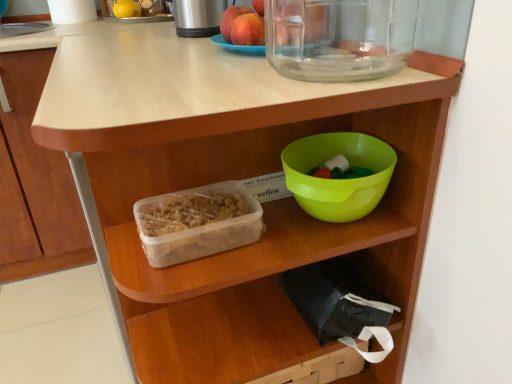
Question: Does matte peach at upper center, the 2th apple in the back-to-front sequence, have a larger size compared to green plastic bowl at center?

Choices:
 (A) no
 (B) yes

Answer: (A)

Question: Is matte peach at upper center, the 1th apple positioned from the front, facing away from green plastic bowl at center?

Choices:
 (A) no
 (B) yes

Answer: (A)

Question: Can you confirm if matte peach at upper center, the 2th apple in the back-to-front sequence, is smaller than green plastic bowl at center?

Choices:
 (A) yes
 (B) no

Answer: (A)

Question: Would you say matte peach at upper center, the 1th apple positioned from the front, is outside green plastic bowl at center?

Choices:
 (A) yes
 (B) no

Answer: (A)

Question: Is matte peach at upper center, the 1th apple positioned from the front, shorter than green plastic bowl at center?

Choices:
 (A) no
 (B) yes

Answer: (B)

Question: In the image, is smooth peach at upper center, the second apple positioned from the front, positioned in front of or behind matte peach at upper center, the 1th apple positioned from the front?

Choices:
 (A) behind
 (B) front

Answer: (A)

Question: Is point (224, 18) closer or farther from the camera than point (234, 18)?

Choices:
 (A) farther
 (B) closer

Answer: (A)

Question: From the image's perspective, is smooth peach at upper center, acting as the first apple starting from the back, above or below matte peach at upper center, the 2th apple in the back-to-front sequence?

Choices:
 (A) above
 (B) below

Answer: (A)

Question: Is smooth peach at upper center, acting as the first apple starting from the back, taller or shorter than matte peach at upper center, the 2th apple in the back-to-front sequence?

Choices:
 (A) tall
 (B) short

Answer: (A)

Question: Is smooth peach at upper center, acting as the first apple starting from the back, situated inside translucent plastic container at center or outside?

Choices:
 (A) inside
 (B) outside

Answer: (B)

Question: Based on their sizes in the image, would you say smooth peach at upper center, the second apple positioned from the front, is bigger or smaller than translucent plastic container at center?

Choices:
 (A) big
 (B) small

Answer: (B)

Question: Considering the positions of smooth peach at upper center, acting as the first apple starting from the back, and translucent plastic container at center in the image, is smooth peach at upper center, acting as the first apple starting from the back, taller or shorter than translucent plastic container at center?

Choices:
 (A) tall
 (B) short

Answer: (A)

Question: From a real-world perspective, is smooth peach at upper center, the second apple positioned from the front, physically located above or below translucent plastic container at center?

Choices:
 (A) below
 (B) above

Answer: (B)

Question: Considering the relative positions of brushed metal thermos at upper center and translucent plastic container at center in the image provided, is brushed metal thermos at upper center to the left or to the right of translucent plastic container at center?

Choices:
 (A) left
 (B) right

Answer: (A)

Question: Is point (207, 6) closer or farther from the camera than point (151, 208)?

Choices:
 (A) closer
 (B) farther

Answer: (B)